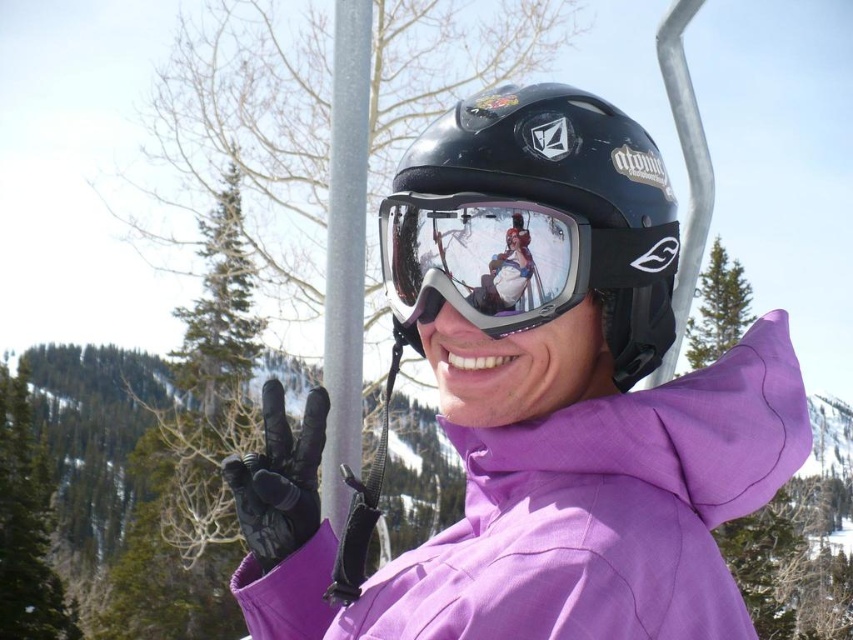
Question: Can you confirm if black matte helmet at center is positioned above transparent plastic goggles at center?

Choices:
 (A) yes
 (B) no

Answer: (A)

Question: Does black matte helmet at center appear over transparent plastic goggles at center?

Choices:
 (A) no
 (B) yes

Answer: (B)

Question: Is black matte helmet at center closer to camera compared to transparent plastic goggles at center?

Choices:
 (A) yes
 (B) no

Answer: (B)